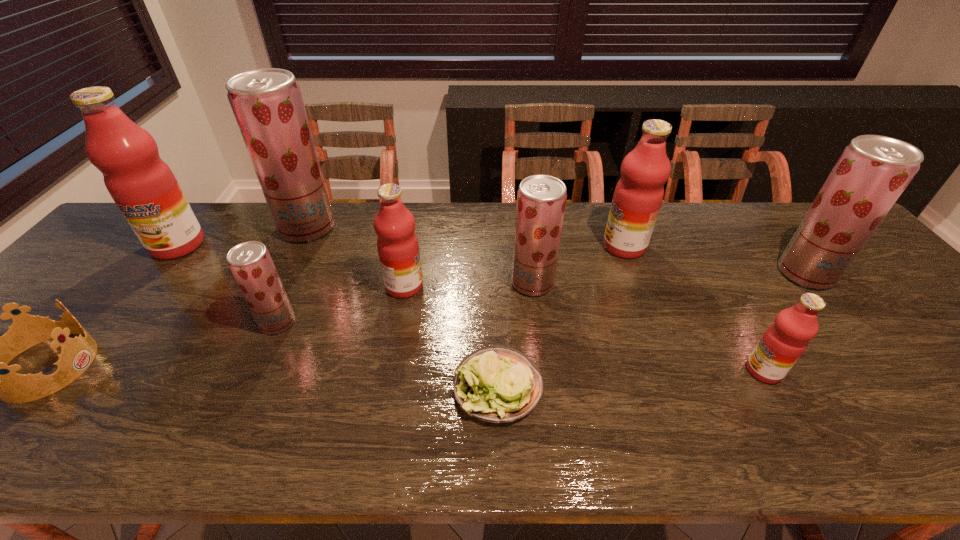
Locate an element on the screen. Image resolution: width=960 pixels, height=540 pixels. the farthest strawberry fruit juice is located at coordinates (267, 103).

Where is `the leftmost pink fruit juice`? This screenshot has width=960, height=540. the leftmost pink fruit juice is located at coordinates tap(143, 186).

Where is `the leftmost fruit juice`? This screenshot has height=540, width=960. the leftmost fruit juice is located at coordinates (143, 186).

Where is `the rightmost strawberry fruit juice`? The width and height of the screenshot is (960, 540). the rightmost strawberry fruit juice is located at coordinates (872, 172).

Identify the location of the rightmost fruit juice. (872, 172).

Locate an element on the screen. The width and height of the screenshot is (960, 540). the third object from right to left is located at coordinates (638, 195).

The image size is (960, 540). I want to click on the second pink fruit juice from right to left, so click(x=638, y=195).

What are the coordinates of `the third biggest strawberry fruit juice` in the screenshot? It's located at (541, 199).

Where is `the second strawberry fruit juice from right to left`? The image size is (960, 540). the second strawberry fruit juice from right to left is located at coordinates (541, 199).

At what (x,y) coordinates should I click in order to perform the action: click on the second pink fruit juice from left to right. Please return your answer as a coordinate pair (x, y). This screenshot has height=540, width=960. Looking at the image, I should click on 397,244.